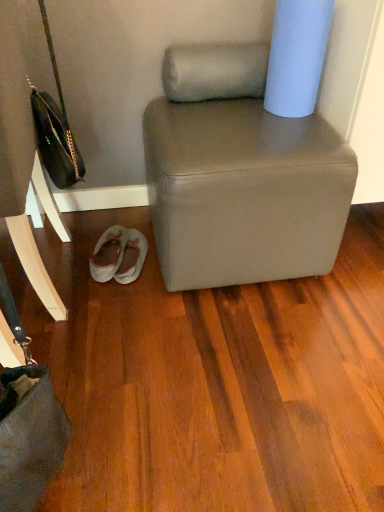
Identify the location of free spot below light gray suede slippers at lower left (from a real-world perspective). (x=120, y=259).